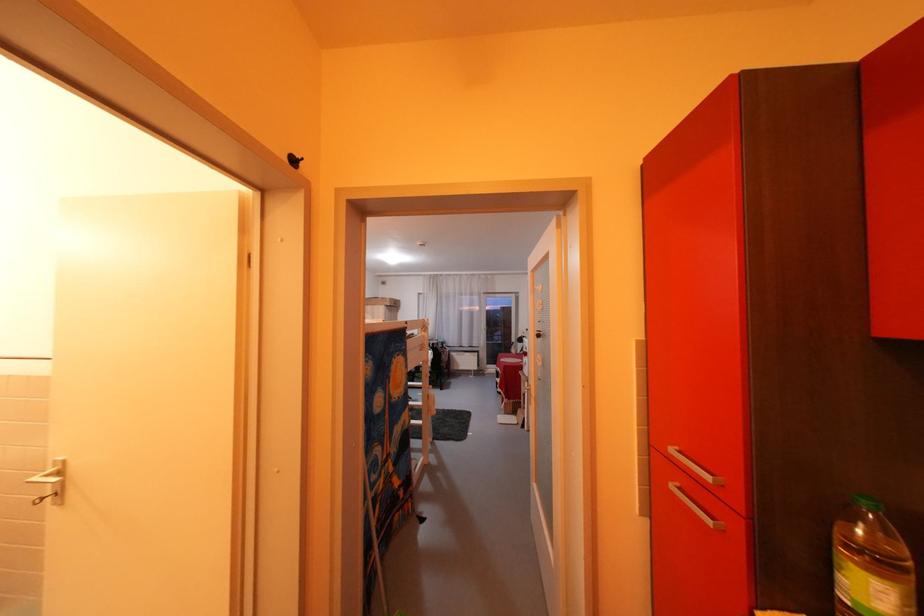
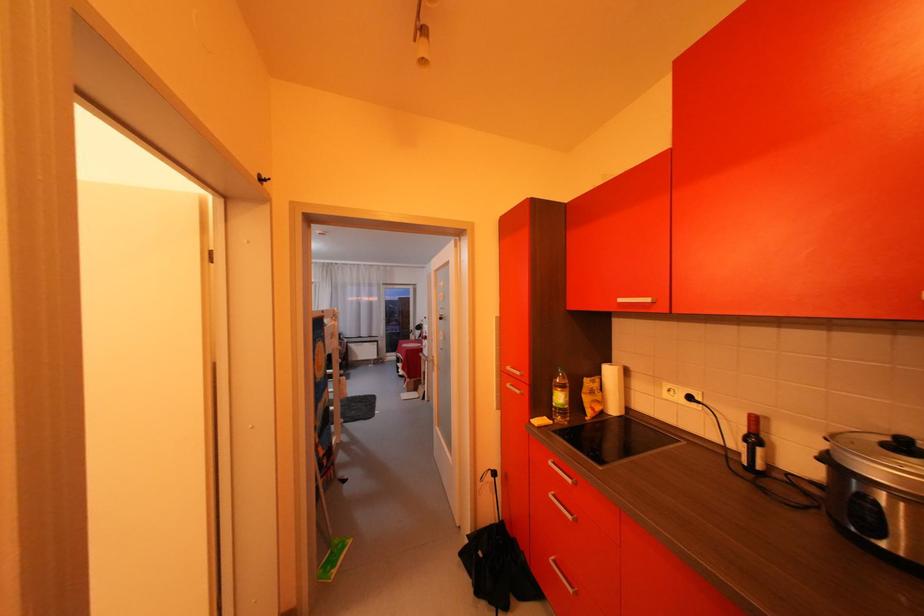
Locate, in the second image, the point that corresponds to (x=685, y=488) in the first image.

(518, 387)